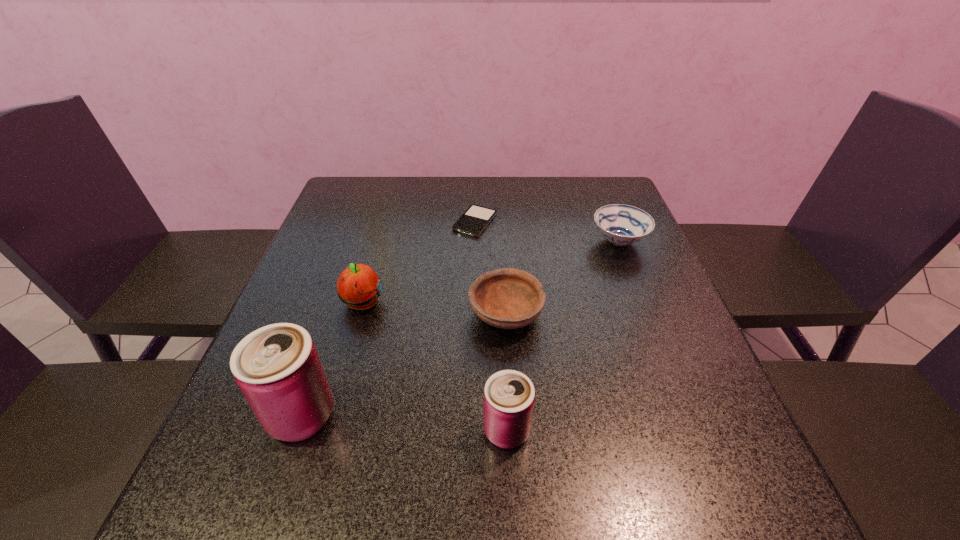
Where is `the left can`? The height and width of the screenshot is (540, 960). the left can is located at coordinates (277, 367).

Image resolution: width=960 pixels, height=540 pixels. In order to click on the taller can in this screenshot , I will do `click(277, 367)`.

In order to click on the right can in this screenshot , I will do `click(509, 395)`.

This screenshot has height=540, width=960. What are the coordinates of `apple` in the screenshot? It's located at (359, 287).

Where is `soup bowl`? soup bowl is located at coordinates (620, 224).

Identify the location of the shortest object. (x=475, y=219).

The image size is (960, 540). What are the coordinates of `bowl` in the screenshot? It's located at (508, 298).

What are the coordinates of `free region located 0.080m on the right of the left can` in the screenshot? It's located at (380, 416).

The image size is (960, 540). Find the location of `free spot located on the left of the shorter can`. free spot located on the left of the shorter can is located at coordinates (357, 430).

At what (x,y) coordinates should I click in order to perform the action: click on vacant point located on the front of the apple. Please return your answer as a coordinate pair (x, y). This screenshot has height=540, width=960. Looking at the image, I should click on (324, 435).